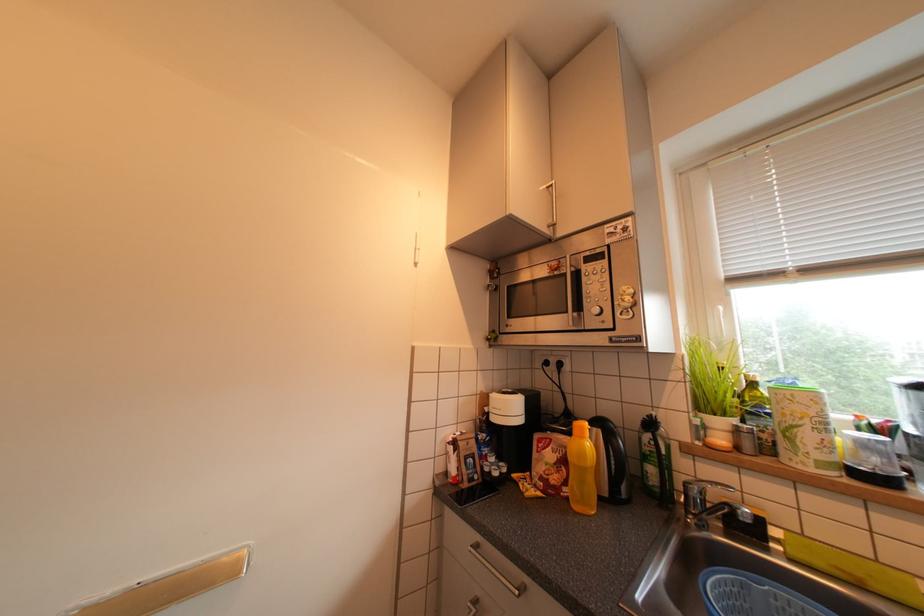
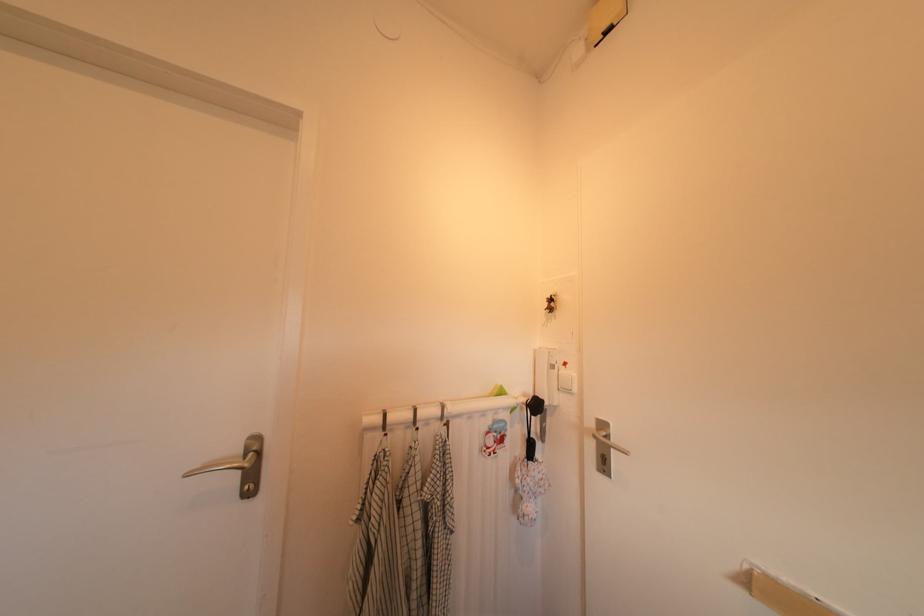
Question: The camera is either moving clockwise (left) or counter-clockwise (right) around the object. The first image is from the beginning of the video and the second image is from the end. Is the camera moving left or right when shooting the video?

Choices:
 (A) Left
 (B) Right

Answer: (B)